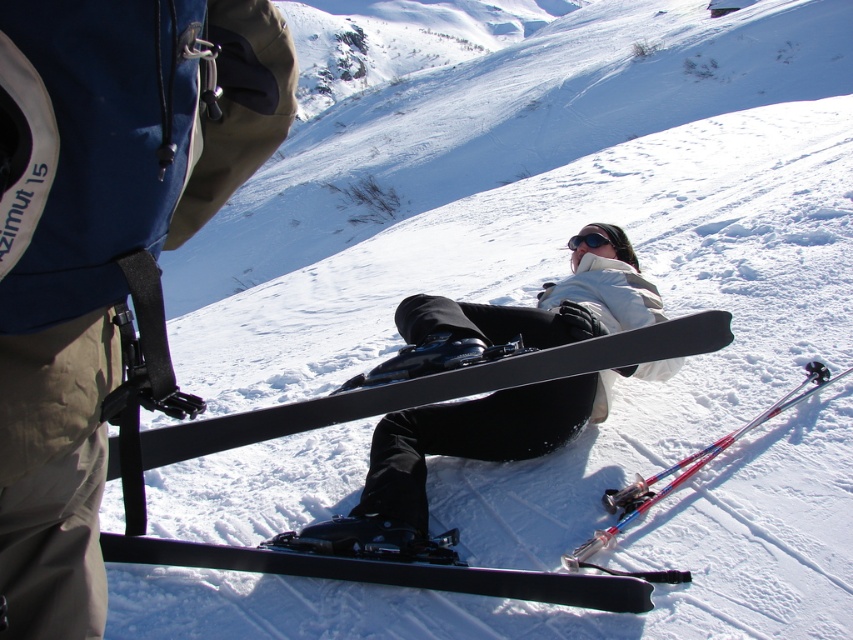
Can you confirm if black matte/solid ski at center is thinner than black matte goggles at center?

In fact, black matte/solid ski at center might be wider than black matte goggles at center.

Is black matte/solid ski at center to the right of black matte goggles at center from the viewer's perspective?

In fact, black matte/solid ski at center is to the left of black matte goggles at center.

Where is `black matte/solid ski at center`? The width and height of the screenshot is (853, 640). black matte/solid ski at center is located at coordinates [437, 387].

This screenshot has height=640, width=853. What do you see at coordinates (451, 456) in the screenshot? I see `matte black snowboard at center` at bounding box center [451, 456].

Which is behind, point (634, 282) or point (726, 316)?

Positioned behind is point (634, 282).

Find the location of `matte black snowboard at center`. matte black snowboard at center is located at coordinates (451, 456).

Based on the photo, can you confirm if black matte ski at center is positioned to the right of black matte goggles at center?

In fact, black matte ski at center is to the left of black matte goggles at center.

Who is higher up, black matte ski at center or black matte goggles at center?

black matte goggles at center

Which is in front, point (105, 532) or point (599, 230)?

Point (105, 532) is more forward.

Locate an element on the screen. This screenshot has width=853, height=640. black matte ski at center is located at coordinates (390, 572).